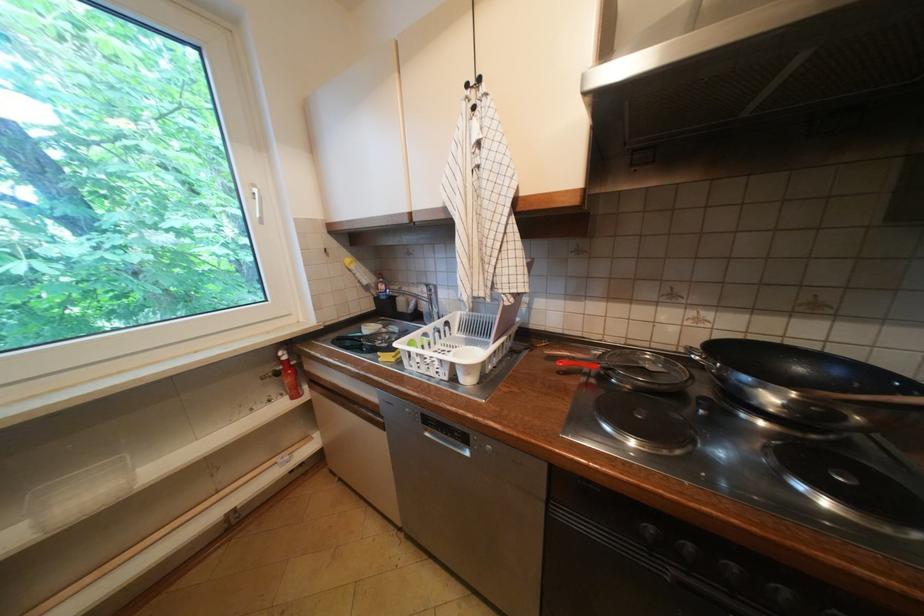
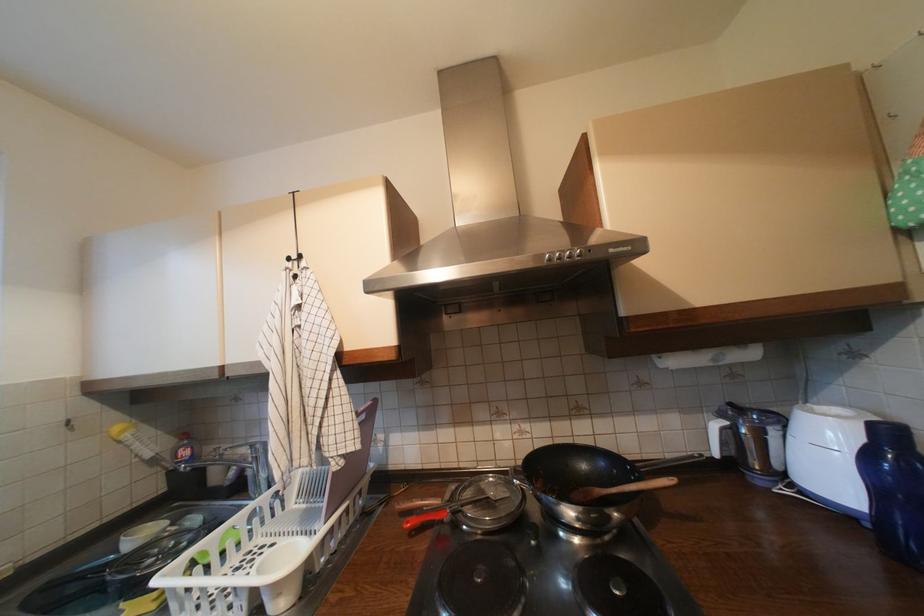
Locate, in the second image, the point that corresponds to pixel 872 399 in the first image.

(623, 492)